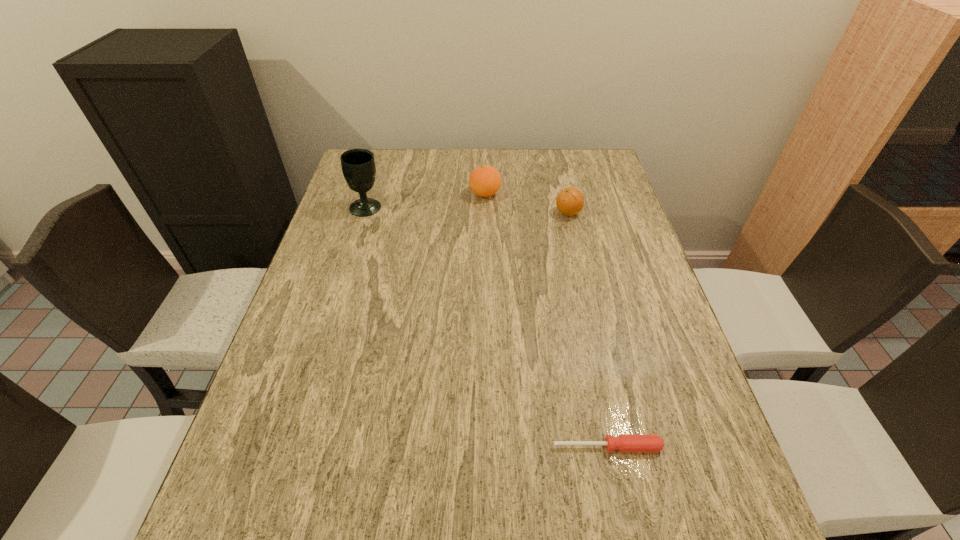
In the image, there is a desktop. Where is `free space at the far right corner`? free space at the far right corner is located at coordinates (574, 159).

Locate an element on the screen. Image resolution: width=960 pixels, height=540 pixels. empty space between the left orange and the shortest object is located at coordinates (546, 320).

In order to click on free space between the chalice and the shortest object in this screenshot , I will do `click(487, 327)`.

I want to click on blank region between the tallest object and the nearest object, so click(x=487, y=327).

Identify the location of vacant point located between the tallest object and the second tallest object. This screenshot has height=540, width=960. (426, 201).

What are the coordinates of `free space between the taller orange and the shorter orange` in the screenshot? It's located at (527, 204).

You are a GUI agent. You are given a task and a screenshot of the screen. Output one action in this format:
    pyautogui.click(x=<x>, y=<y>)
    Task: Click on the vacant area between the tallest object and the screwdriver
    The height and width of the screenshot is (540, 960).
    Given the screenshot: What is the action you would take?
    pyautogui.click(x=487, y=327)

Where is `vacant space that's between the shortest object and the taller orange`? vacant space that's between the shortest object and the taller orange is located at coordinates (546, 320).

The width and height of the screenshot is (960, 540). I want to click on empty space between the second object from left to right and the leftmost object, so (426, 201).

This screenshot has width=960, height=540. Identify the location of vacant area that lies between the tallest object and the right orange. (468, 210).